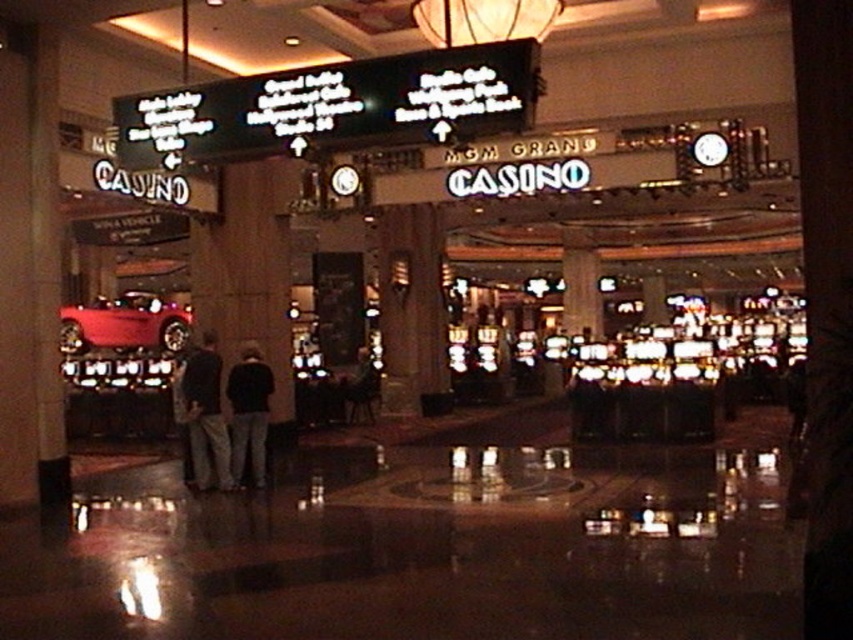
Who is higher up, shiny red car at left or dark fabric pants at center?

shiny red car at left

Consider the image. Which of these two, shiny red car at left or dark fabric pants at center, stands taller?

With more height is shiny red car at left.

Which is in front, point (172, 326) or point (242, 371)?

Point (242, 371) is more forward.

At what (x,y) coordinates should I click in order to perform the action: click on shiny red car at left. Please return your answer as a coordinate pair (x, y). The width and height of the screenshot is (853, 640). Looking at the image, I should click on (125, 323).

Who is positioned more to the right, shiny red car at left or dark clothing at center?

dark clothing at center

Describe the element at coordinates (125, 323) in the screenshot. I see `shiny red car at left` at that location.

Looking at this image, measure the distance between shiny red car at left and camera.

shiny red car at left is 9.58 meters from camera.

This screenshot has height=640, width=853. Identify the location of shiny red car at left. (125, 323).

Does point (202, 445) come in front of point (262, 454)?

Yes.

Does dark clothing at center have a smaller size compared to dark fabric pants at center?

No, dark clothing at center is not smaller than dark fabric pants at center.

Between point (202, 333) and point (236, 419), which one is positioned behind?

The point (202, 333) is behind.

Identify the location of dark clothing at center. The width and height of the screenshot is (853, 640). (206, 413).